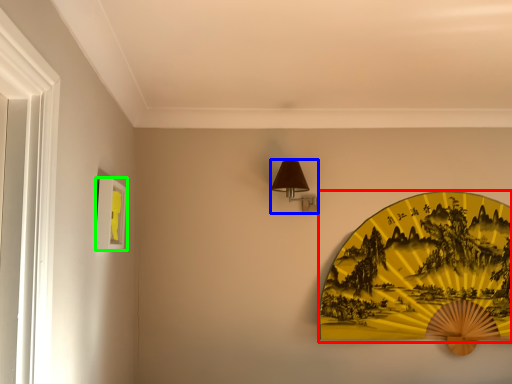
Question: Considering the real-world distances, which object is farthest from design (highlighted by a red box)? table lamp (highlighted by a blue box) or picture frame (highlighted by a green box)?

Choices:
 (A) table lamp
 (B) picture frame

Answer: (B)